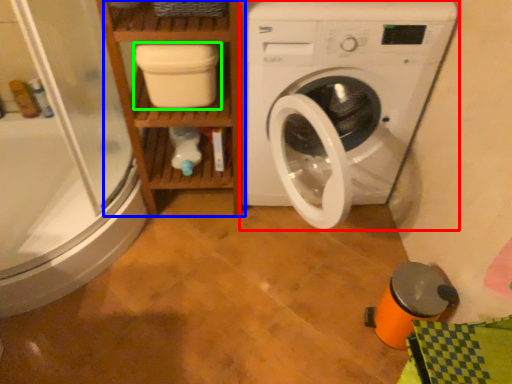
Question: Which object is positioned closest to washing machine (highlighted by a red box)? Select from shelf (highlighted by a blue box) and dish washer (highlighted by a green box).

Choices:
 (A) shelf
 (B) dish washer

Answer: (A)